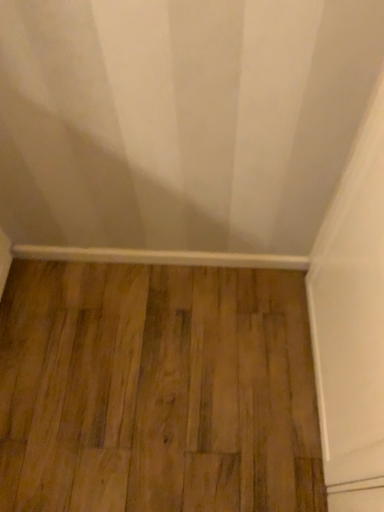
Where is `unoccupied area in front of white smooth baseboard at bottom`? The image size is (384, 512). unoccupied area in front of white smooth baseboard at bottom is located at coordinates (160, 371).